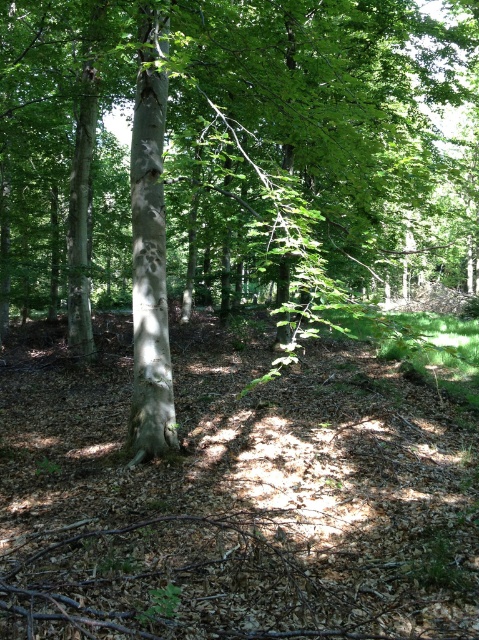
Is green smooth tree trunk at center positioned at the back of smooth white bark at center?

No, it is not.

Who is more distant from viewer, (167, 372) or (137, 442)?

The point (167, 372) is behind.

Where is `green smooth tree trunk at center`? green smooth tree trunk at center is located at coordinates (230, 150).